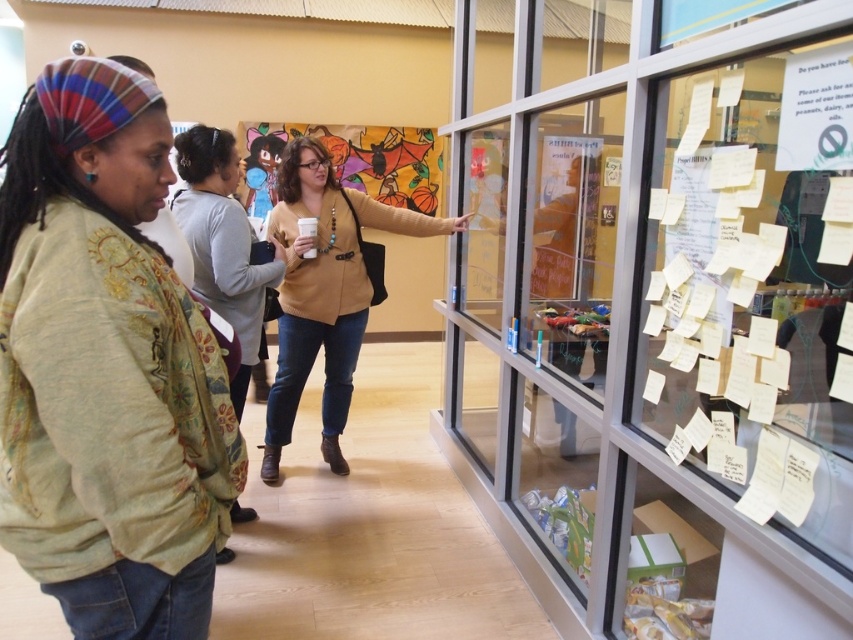
Question: Can you confirm if matte brown sweater at center is wider than matte beige sweater at center?

Choices:
 (A) no
 (B) yes

Answer: (B)

Question: Does clear glass window at right have a greater width compared to matte beige sweater at center?

Choices:
 (A) no
 (B) yes

Answer: (B)

Question: Which point is closer to the camera?

Choices:
 (A) matte beige sweater at center
 (B) clear glass window at right
 (C) floral embroidered jacket at left
 (D) matte brown sweater at center

Answer: (C)

Question: Among these objects, which one is farthest from the camera?

Choices:
 (A) floral embroidered jacket at left
 (B) matte beige sweater at center

Answer: (B)

Question: Can you confirm if floral embroidered jacket at left is positioned below matte brown sweater at center?

Choices:
 (A) no
 (B) yes

Answer: (B)

Question: Which of the following is the farthest from the observer?

Choices:
 (A) (183, 216)
 (B) (538, 212)
 (C) (323, 436)
 (D) (218, 369)

Answer: (C)